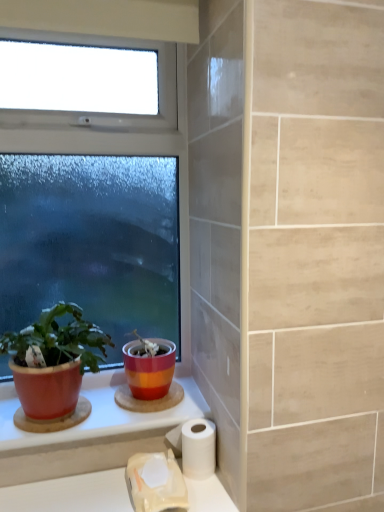
Identify the location of free point above matte ceramic counter top at lower left (from a real-world perspective). The height and width of the screenshot is (512, 384). (102, 408).